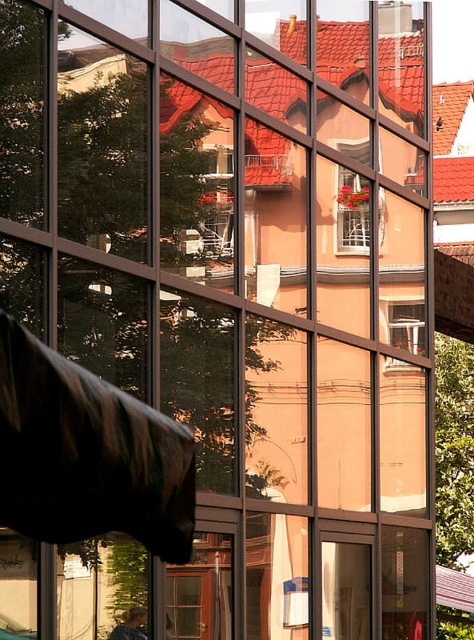
Does clear glass window at center appear over white wooden window at center?

Incorrect, clear glass window at center is not positioned above white wooden window at center.

Where is `clear glass window at center`? The image size is (474, 640). clear glass window at center is located at coordinates (402, 317).